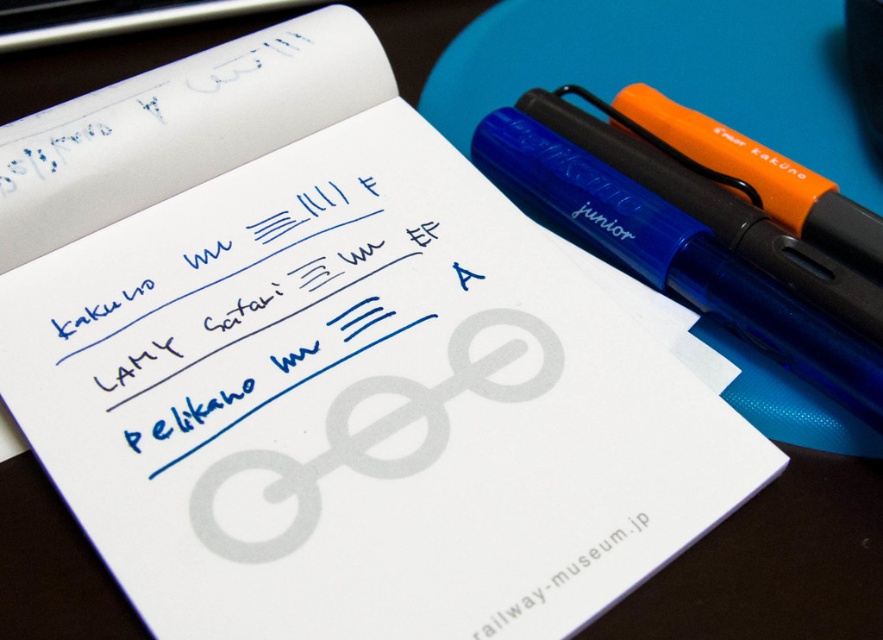
Question: Is blue ink writing at center wider than orange matte pen at upper right?

Choices:
 (A) no
 (B) yes

Answer: (A)

Question: Can you confirm if blue ink writing at center is smaller than white paper at lower center?

Choices:
 (A) no
 (B) yes

Answer: (A)

Question: Which object is farther from the camera taking this photo?

Choices:
 (A) blue ink writing at center
 (B) orange matte pen at upper right

Answer: (A)

Question: Which object is closer to the camera taking this photo?

Choices:
 (A) blue ink writing at center
 (B) orange matte pen at upper right
 (C) white paper at lower center

Answer: (C)

Question: Observing the image, what is the correct spatial positioning of blue ink writing at center in reference to orange matte pen at upper right?

Choices:
 (A) right
 (B) left

Answer: (B)

Question: Which of the following is the farthest from the observer?

Choices:
 (A) (x=342, y=300)
 (B) (x=744, y=262)

Answer: (A)